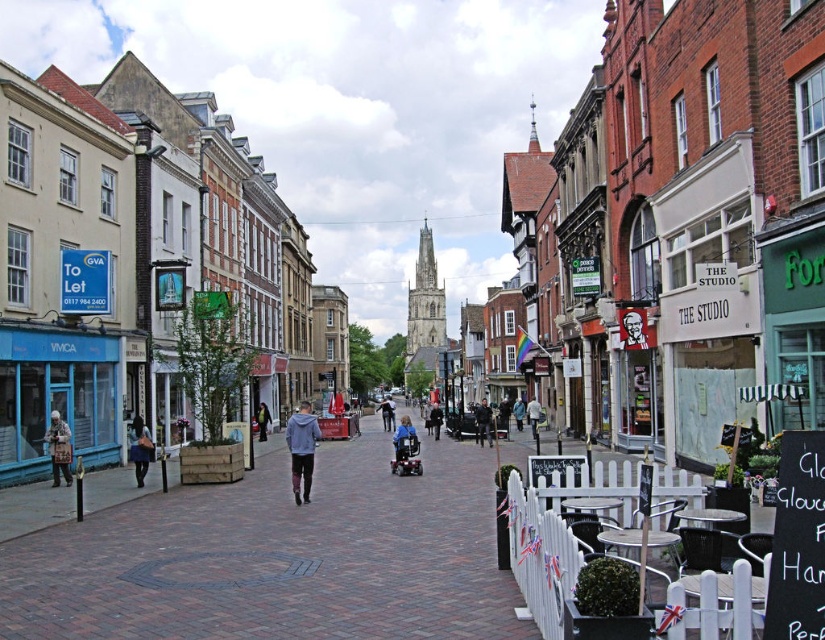
Is dark gray sweater at center shorter than green fabric jacket at center?

Indeed, dark gray sweater at center has a lesser height compared to green fabric jacket at center.

Which is behind, point (503, 403) or point (267, 416)?

Point (503, 403)

Locate an element on the screen. dark gray sweater at center is located at coordinates (503, 417).

Is point (385, 426) behind point (519, 412)?

Yes, point (385, 426) is behind point (519, 412).

Does dark gray fabric jacket at center have a smaller size compared to blue denim jacket at center?

Incorrect, dark gray fabric jacket at center is not smaller in size than blue denim jacket at center.

Image resolution: width=825 pixels, height=640 pixels. Describe the element at coordinates (387, 413) in the screenshot. I see `dark gray fabric jacket at center` at that location.

Locate an element on the screen. The height and width of the screenshot is (640, 825). dark gray fabric jacket at center is located at coordinates (387, 413).

Is light blue hoodie at center shorter than blue denim jacket at center?

In fact, light blue hoodie at center may be taller than blue denim jacket at center.

At what (x,y) coordinates should I click in order to perform the action: click on light blue hoodie at center. Please return your answer as a coordinate pair (x, y). Image resolution: width=825 pixels, height=640 pixels. Looking at the image, I should click on (300, 449).